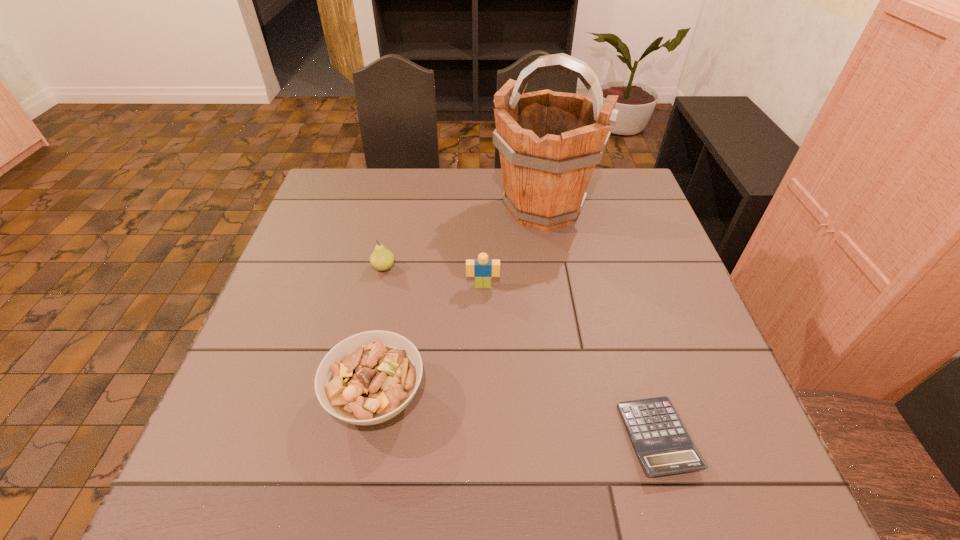
Where is `vacant point located between the pear and the farthest object`? The height and width of the screenshot is (540, 960). vacant point located between the pear and the farthest object is located at coordinates (464, 238).

Locate an element on the screen. free space between the calculator and the stew is located at coordinates (517, 417).

Identify the location of free space between the shortest object and the Lego. (570, 361).

At what (x,y) coordinates should I click in order to perform the action: click on object identified as the second closest to the shortest object. Please return your answer as a coordinate pair (x, y). This screenshot has width=960, height=540. Looking at the image, I should click on (368, 378).

Select which object is the fourth closest to the stew. Please provide its 2D coordinates. Your answer should be formatted as a tuple, i.e. [(x, y)], where the tuple contains the x and y coordinates of a point satisfying the conditions above.

[(549, 142)]

Where is `free space that satisfies the following two spatial constraints: 1. on the front side of the stew; 2. on the left side of the calculator`? Image resolution: width=960 pixels, height=540 pixels. free space that satisfies the following two spatial constraints: 1. on the front side of the stew; 2. on the left side of the calculator is located at coordinates (370, 437).